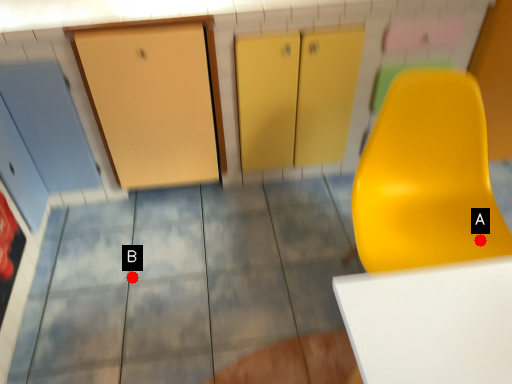
Question: Two points are circled on the image, labeled by A and B beside each circle. Which point is closer to the camera?

Choices:
 (A) A is closer
 (B) B is closer

Answer: (A)